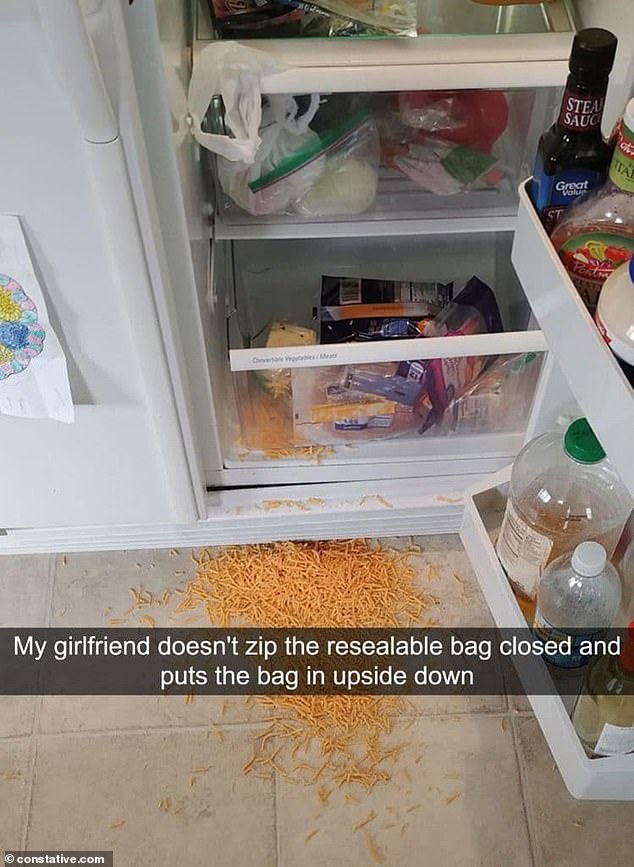
Find the location of a particular element. The width and height of the screenshot is (634, 867). shopping bag hanging out of drawer is located at coordinates (230, 68).